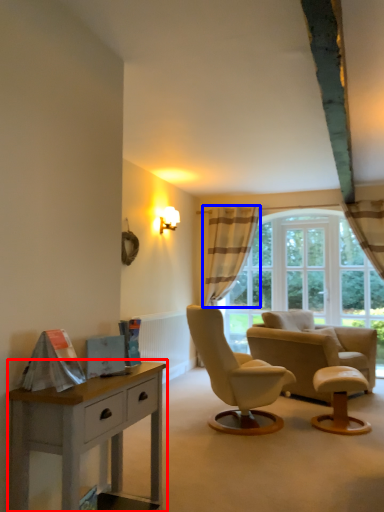
Question: Which object is closer to the camera taking this photo, nightstand (highlighted by a red box) or curtain (highlighted by a blue box)?

Choices:
 (A) nightstand
 (B) curtain

Answer: (A)